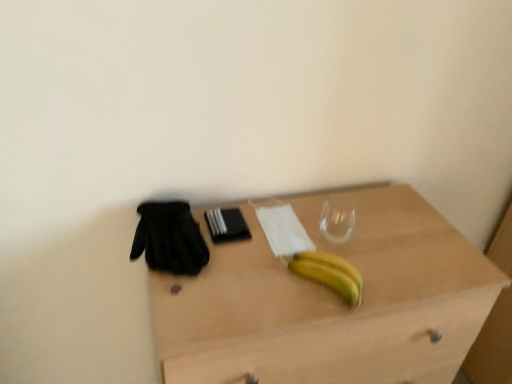
Question: Can you confirm if black mesh glove at left is bigger than light wood desk at center?

Choices:
 (A) yes
 (B) no

Answer: (B)

Question: Considering the relative sizes of black mesh glove at left and light wood desk at center in the image provided, is black mesh glove at left shorter than light wood desk at center?

Choices:
 (A) no
 (B) yes

Answer: (B)

Question: From the image's perspective, is black mesh glove at left on top of light wood desk at center?

Choices:
 (A) no
 (B) yes

Answer: (B)

Question: From a real-world perspective, is black mesh glove at left located beneath light wood desk at center?

Choices:
 (A) yes
 (B) no

Answer: (B)

Question: Is black mesh glove at left oriented towards light wood desk at center?

Choices:
 (A) yes
 (B) no

Answer: (B)

Question: Is yellow matte banana at center inside or outside of black mesh glove at left?

Choices:
 (A) inside
 (B) outside

Answer: (B)

Question: From the image's perspective, is yellow matte banana at center above or below black mesh glove at left?

Choices:
 (A) below
 (B) above

Answer: (A)

Question: From a real-world perspective, is yellow matte banana at center above or below black mesh glove at left?

Choices:
 (A) above
 (B) below

Answer: (B)

Question: Considering their positions, is yellow matte banana at center located in front of or behind black mesh glove at left?

Choices:
 (A) behind
 (B) front

Answer: (B)

Question: Based on their sizes in the image, would you say black mesh glove at left is bigger or smaller than light wood desk at center?

Choices:
 (A) big
 (B) small

Answer: (B)

Question: From the image's perspective, is black mesh glove at left positioned above or below light wood desk at center?

Choices:
 (A) below
 (B) above

Answer: (B)

Question: Does point (144, 223) appear closer or farther from the camera than point (390, 266)?

Choices:
 (A) closer
 (B) farther

Answer: (B)

Question: Considering the positions of black mesh glove at left and light wood desk at center in the image, is black mesh glove at left taller or shorter than light wood desk at center?

Choices:
 (A) short
 (B) tall

Answer: (A)

Question: From a real-world perspective, is black mesh glove at left above or below yellow matte banana at center?

Choices:
 (A) above
 (B) below

Answer: (A)

Question: Is black mesh glove at left wider or thinner than yellow matte banana at center?

Choices:
 (A) wide
 (B) thin

Answer: (A)